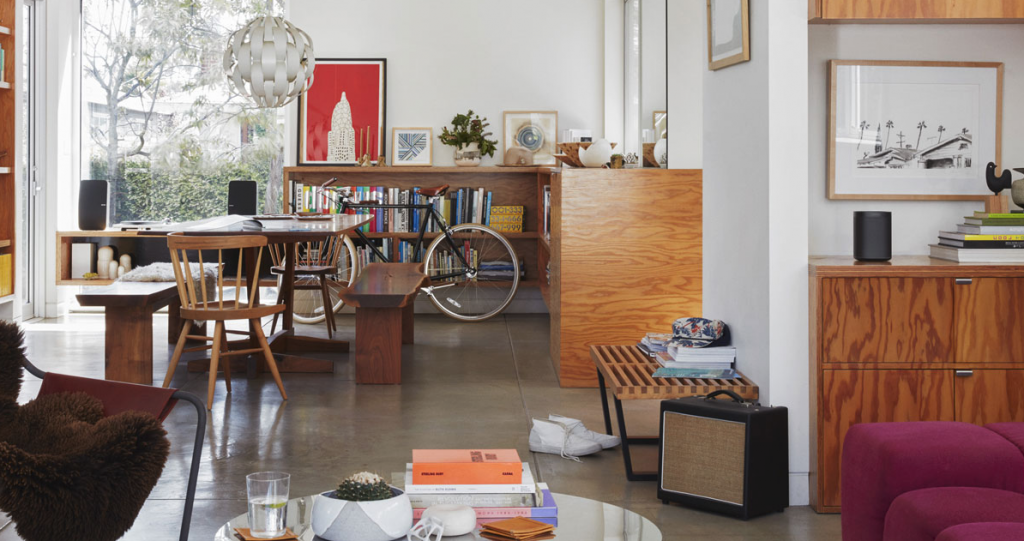
Identify the location of window. (172, 105).